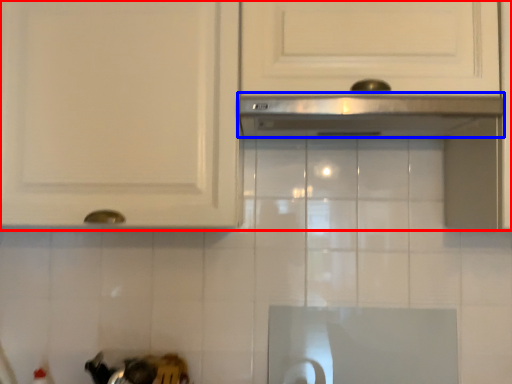
Question: Which object is closer to the camera taking this photo, cabinetry (highlighted by a red box) or exhaust hood (highlighted by a blue box)?

Choices:
 (A) cabinetry
 (B) exhaust hood

Answer: (B)